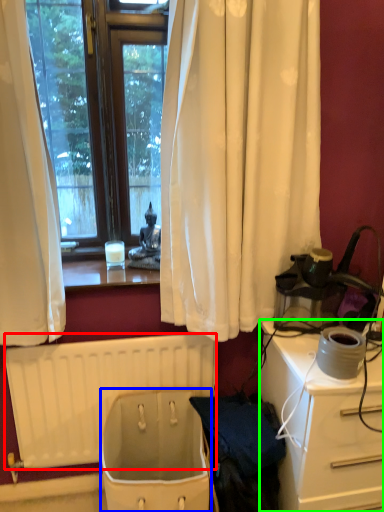
Question: Which is nearer to the radiator (highlighted by a red box)? toilet bowl (highlighted by a blue box) or desk (highlighted by a green box).

Choices:
 (A) toilet bowl
 (B) desk

Answer: (A)